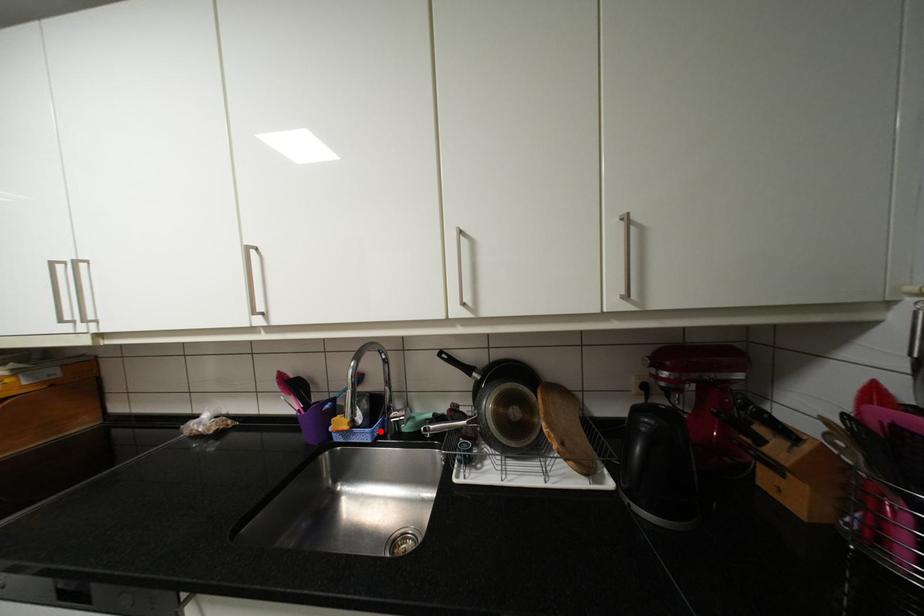
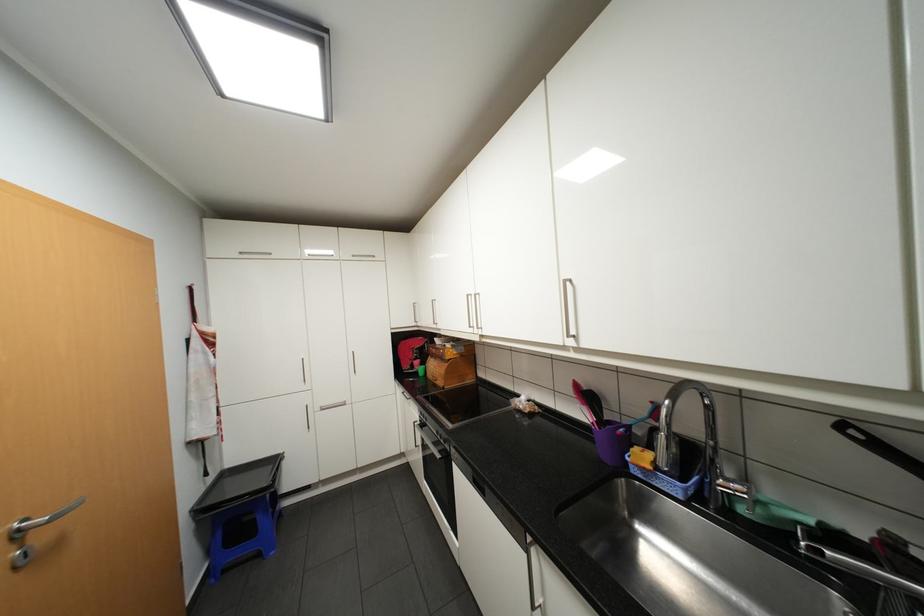
Question: I am providing you with two images of the same scene from different viewpoints. A red point is marked on the first image. Is the red point's position out of view in image 2?

Choices:
 (A) Yes
 (B) No

Answer: (B)